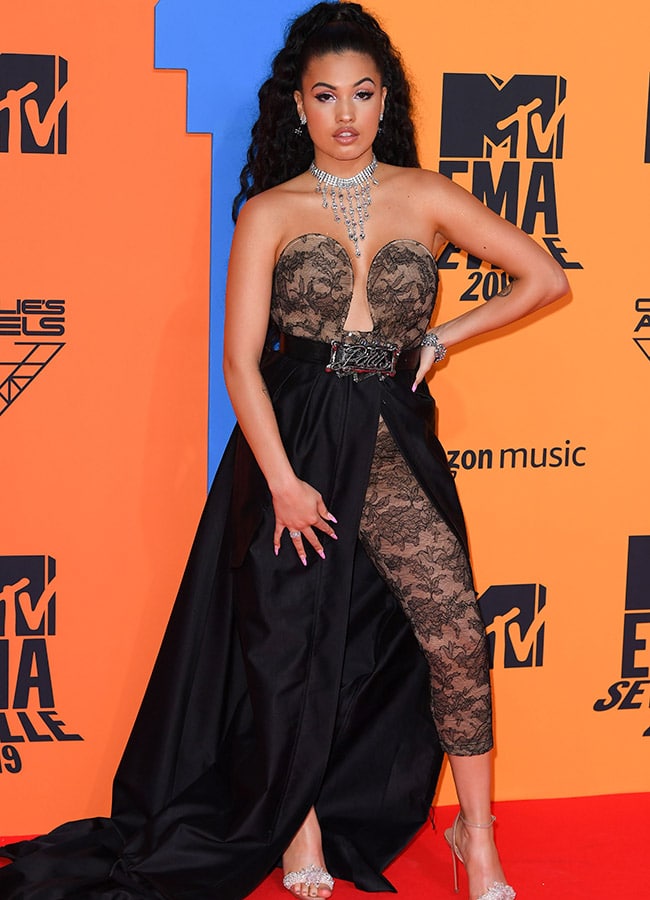
The height and width of the screenshot is (900, 650). In order to click on backdrop in this screenshot , I will do `click(121, 564)`.